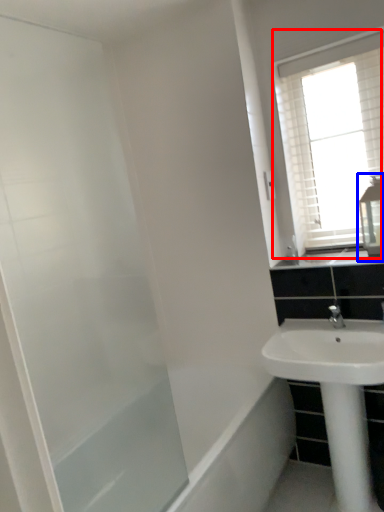
Question: Which point is closer to the camera, window (highlighted by a red box) or medicine cabinet (highlighted by a blue box)?

Choices:
 (A) window
 (B) medicine cabinet

Answer: (B)